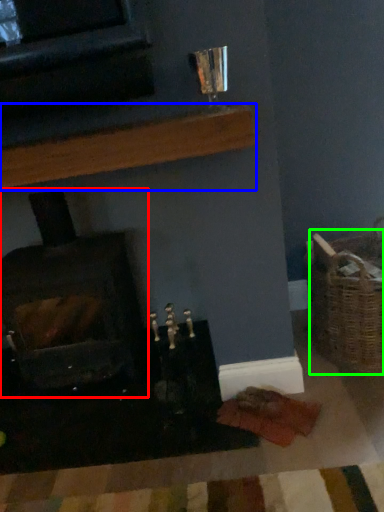
Question: Estimate the real-world distances between objects in this image. Which object is closer to wood burning stove (highlighted by a red box), shelf (highlighted by a blue box) or basket (highlighted by a green box)?

Choices:
 (A) shelf
 (B) basket

Answer: (A)